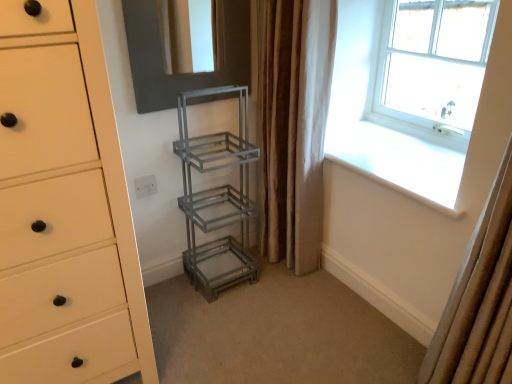
Question: From a real-world perspective, relative to beige fabric curtain at right, which is the first curtain from right to left, is brown textured curtain at right, the 1th curtain viewed from the left, vertically above or below?

Choices:
 (A) below
 (B) above

Answer: (A)

Question: Do you think brown textured curtain at right, the 1th curtain viewed from the left, is within beige fabric curtain at right, the 2th curtain positioned from the left, or outside of it?

Choices:
 (A) outside
 (B) inside

Answer: (A)

Question: Which object is positioned farthest from the metallic gray shelving unit at center?

Choices:
 (A) matte black mirror at upper center
 (B) matte white chest of drawers at left
 (C) beige fabric curtain at right, the 2th curtain positioned from the left
 (D) metallic gray shelf at center
 (E) clear glass window at upper right

Answer: (E)

Question: Considering the real-world distances, which object is farthest from the metallic gray shelf at center?

Choices:
 (A) beige fabric curtain at right, the 2th curtain positioned from the left
 (B) clear glass window at upper right
 (C) matte white chest of drawers at left
 (D) matte black mirror at upper center
 (E) brown textured curtain at right, positioned as the second curtain in front-to-back order

Answer: (A)